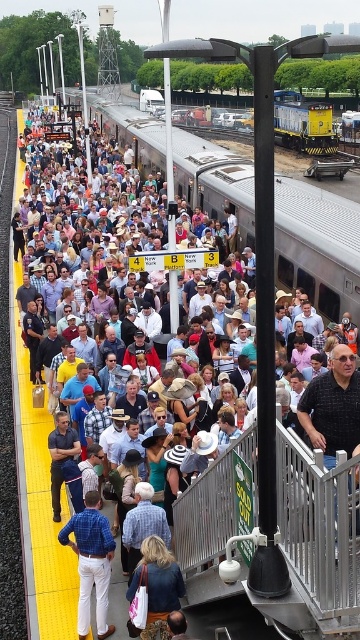
Is metallic silver rail at center to the right of silver metallic train at center from the viewer's perspective?

Correct, you'll find metallic silver rail at center to the right of silver metallic train at center.

Does point (326, 561) lie behind point (307, 273)?

No.

I want to click on metallic silver rail at center, so click(320, 531).